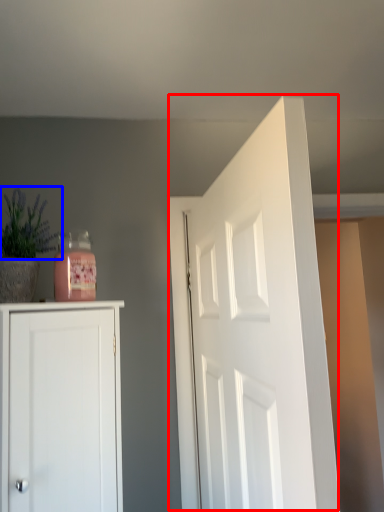
Question: Among these objects, which one is nearest to the camera, door (highlighted by a red box) or plant (highlighted by a blue box)?

Choices:
 (A) door
 (B) plant

Answer: (A)